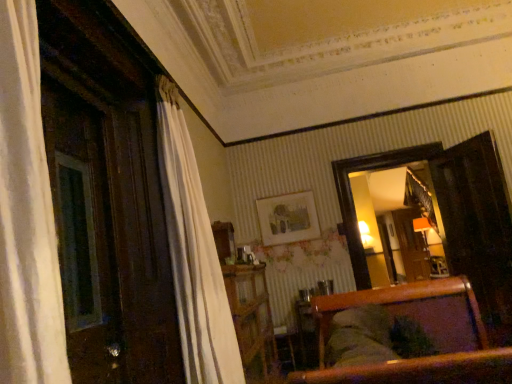
Question: Does wooden dresser at center have a greater width compared to matte wooden picture frame at center?

Choices:
 (A) no
 (B) yes

Answer: (B)

Question: Considering the relative positions of wooden dresser at center and matte wooden picture frame at center in the image provided, is wooden dresser at center to the right of matte wooden picture frame at center from the viewer's perspective?

Choices:
 (A) yes
 (B) no

Answer: (B)

Question: Is wooden dresser at center looking in the opposite direction of matte wooden picture frame at center?

Choices:
 (A) yes
 (B) no

Answer: (B)

Question: Considering the relative sizes of wooden dresser at center and matte wooden picture frame at center in the image provided, is wooden dresser at center bigger than matte wooden picture frame at center?

Choices:
 (A) no
 (B) yes

Answer: (B)

Question: Is wooden dresser at center not near matte wooden picture frame at center?

Choices:
 (A) no
 (B) yes

Answer: (B)

Question: From a real-world perspective, is wooden dresser at center under matte wooden picture frame at center?

Choices:
 (A) yes
 (B) no

Answer: (A)

Question: Is matte wooden picture frame at center taller than wooden dresser at center?

Choices:
 (A) yes
 (B) no

Answer: (B)

Question: Can you confirm if matte wooden picture frame at center is positioned to the left of wooden dresser at center?

Choices:
 (A) no
 (B) yes

Answer: (A)

Question: From a real-world perspective, is matte wooden picture frame at center physically below wooden dresser at center?

Choices:
 (A) yes
 (B) no

Answer: (B)

Question: Are matte wooden picture frame at center and wooden dresser at center beside each other?

Choices:
 (A) no
 (B) yes

Answer: (A)

Question: Considering the relative sizes of matte wooden picture frame at center and wooden dresser at center in the image provided, is matte wooden picture frame at center shorter than wooden dresser at center?

Choices:
 (A) yes
 (B) no

Answer: (A)

Question: Is matte wooden picture frame at center outside of wooden dresser at center?

Choices:
 (A) no
 (B) yes

Answer: (B)

Question: From the image's perspective, is matte wooden picture frame at center over wooden armchair at center?

Choices:
 (A) yes
 (B) no

Answer: (A)